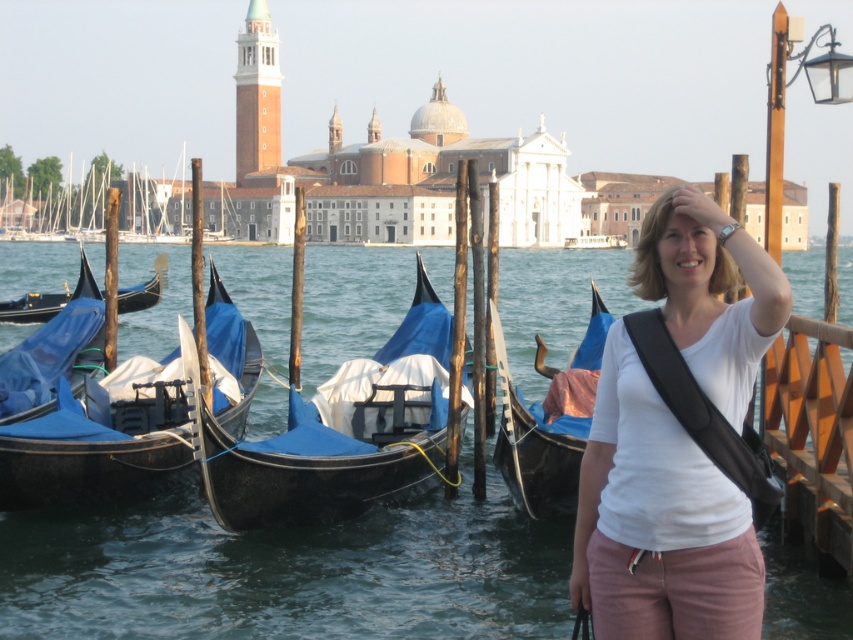
Question: Which object is the farthest from the blue polished wood gondola at center?

Choices:
 (A) white matte shirt at center
 (B) blue fabric boat at right

Answer: (A)

Question: Does blue polished wood gondola at center come in front of blue fabric boat at right?

Choices:
 (A) no
 (B) yes

Answer: (B)

Question: Does blue fabric boat at right appear under blue polished wood gondola at left?

Choices:
 (A) yes
 (B) no

Answer: (A)

Question: Is white matte shirt at center above blue fabric gondola at left?

Choices:
 (A) yes
 (B) no

Answer: (B)

Question: Which is farther from the transparent water at center?

Choices:
 (A) blue polished wood gondola at left
 (B) white matte shirt at center
 (C) blue polished wood gondola at center
 (D) blue fabric gondola at left

Answer: (B)

Question: Based on their relative distances, which object is nearer to the white matte shirt at center?

Choices:
 (A) transparent water at center
 (B) blue fabric boat at right

Answer: (B)